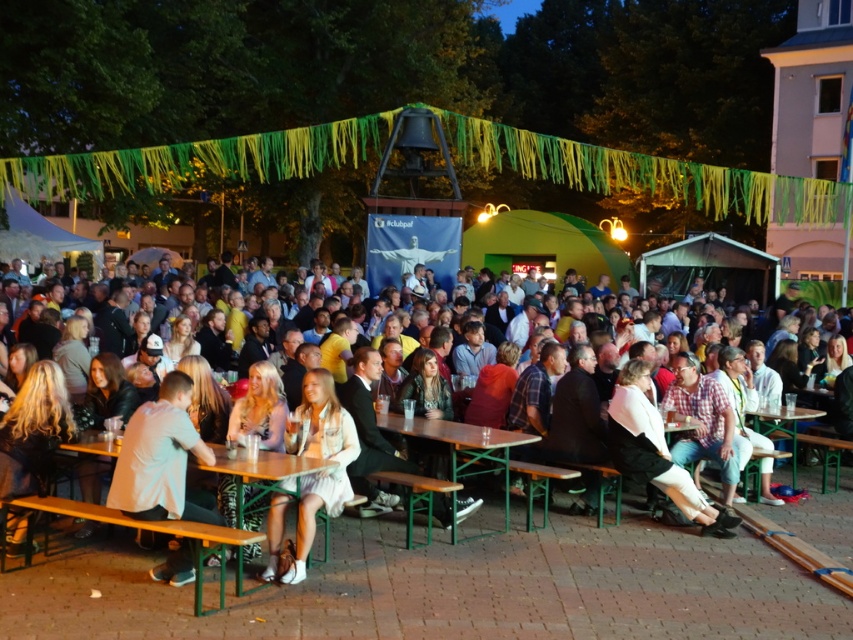
Can you confirm if white leather shoes at center is wider than green wooden table at center?

Yes, white leather shoes at center is wider than green wooden table at center.

Who is positioned more to the left, white leather shoes at center or green wooden table at center?

Positioned to the left is white leather shoes at center.

Is point (643, 472) closer to camera compared to point (747, 410)?

Yes, point (643, 472) is closer to viewer.

Where is `white leather shoes at center`? white leather shoes at center is located at coordinates (654, 451).

Does white leather shoes at center have a lesser height compared to wooden table at center?

Incorrect, white leather shoes at center's height does not fall short of wooden table at center's.

Measure the distance between white leather shoes at center and camera.

A distance of 14.85 meters exists between white leather shoes at center and camera.

Who is more forward, (642, 419) or (450, 424)?

Point (642, 419) is more forward.

Identify the location of white leather shoes at center. This screenshot has width=853, height=640. (654, 451).

Does wooden table at center come in front of green metal table at lower left?

No.

Which is in front, point (490, 433) or point (263, 474)?

Point (263, 474) is more forward.

Between point (450, 467) and point (294, 467), which one is positioned in front?

Positioned in front is point (294, 467).

At what (x,y) coordinates should I click in order to perform the action: click on wooden table at center. Please return your answer as a coordinate pair (x, y). The width and height of the screenshot is (853, 640). Looking at the image, I should click on (463, 448).